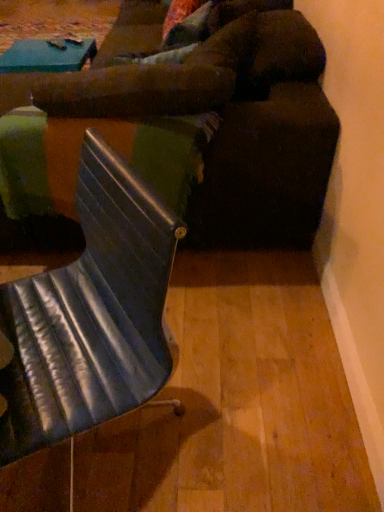
Question: From their relative heights in the image, would you say metallic blue chair at center is taller or shorter than metallic silver table at center?

Choices:
 (A) short
 (B) tall

Answer: (B)

Question: From a real-world perspective, is metallic blue chair at center above or below metallic silver table at center?

Choices:
 (A) below
 (B) above

Answer: (B)

Question: Which is farther from the metallic blue chair at center?

Choices:
 (A) metallic silver table at center
 (B) velvet brown couch at center

Answer: (B)

Question: Estimate the real-world distances between objects in this image. Which object is closer to the metallic blue chair at center?

Choices:
 (A) velvet brown couch at center
 (B) metallic silver table at center

Answer: (B)